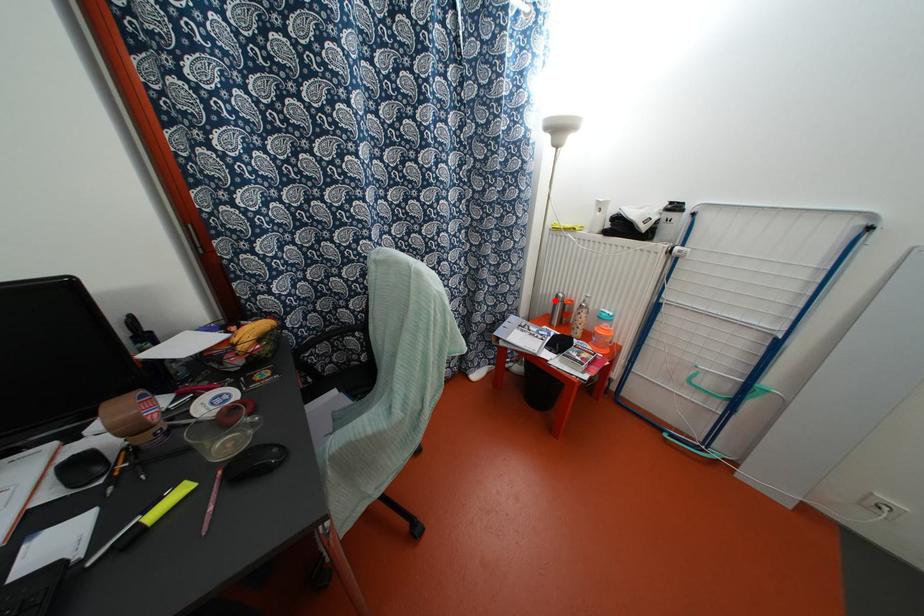
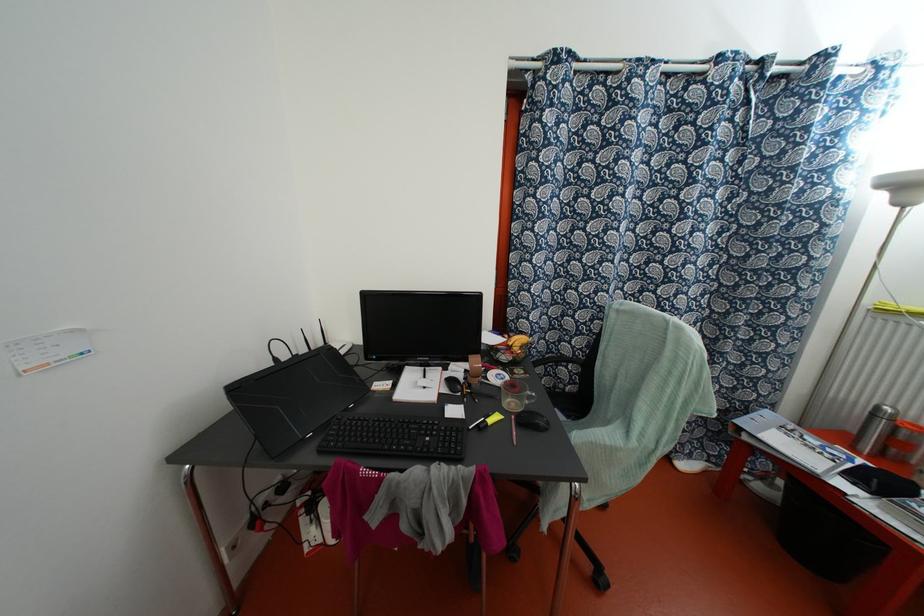
Question: I am providing you with two images of the same scene from different viewpoints. Image1 has a red point marked. In image2, the corresponding 3D location appears at what relative position? Reply with the corresponding letter.

Choices:
 (A) Closer
 (B) Farther

Answer: (B)